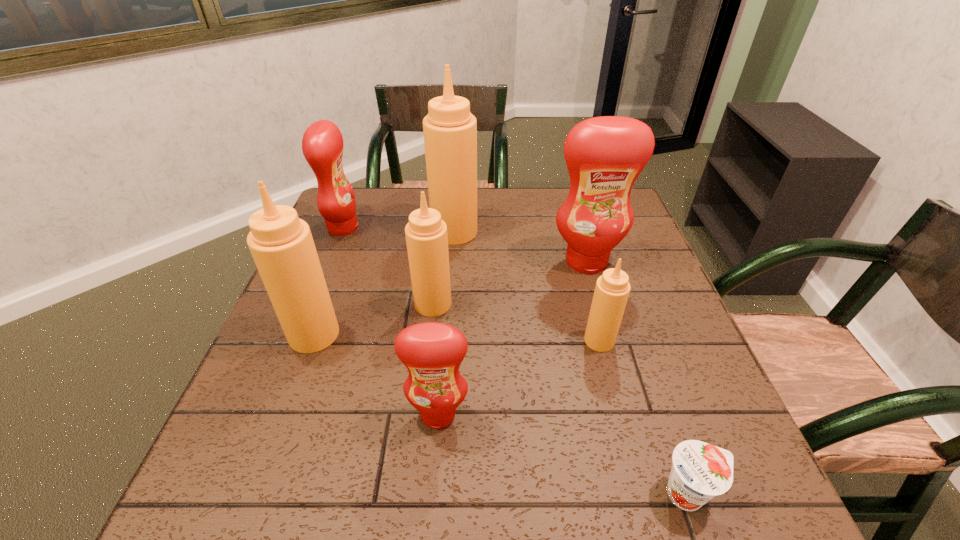
Locate an element on the screen. This screenshot has width=960, height=540. condiment that stands as the fourth closest to the second smallest red condiment is located at coordinates (604, 155).

The image size is (960, 540). In order to click on condiment object that ranks as the second closest to the third smallest tan condiment in this screenshot , I will do `click(432, 352)`.

Where is `tan condiment object that ranks as the third closest to the second smallest tan condiment`? The image size is (960, 540). tan condiment object that ranks as the third closest to the second smallest tan condiment is located at coordinates (612, 289).

Where is `the third closest tan condiment relative to the second biggest tan condiment`? This screenshot has width=960, height=540. the third closest tan condiment relative to the second biggest tan condiment is located at coordinates point(612,289).

Identify which red condiment is the second nearest to the leftmost tan condiment. Please provide its 2D coordinates. Your answer should be formatted as a tuple, i.e. [(x, y)], where the tuple contains the x and y coordinates of a point satisfying the conditions above.

[(322, 144)]

Identify which red condiment is located as the third nearest to the second smallest tan condiment. Please provide its 2D coordinates. Your answer should be formatted as a tuple, i.e. [(x, y)], where the tuple contains the x and y coordinates of a point satisfying the conditions above.

[(322, 144)]

The image size is (960, 540). Find the location of `free point that satisfies the following two spatial constraints: 1. on the label side of the farthest red condiment; 2. on the right side of the third biggest tan condiment`. free point that satisfies the following two spatial constraints: 1. on the label side of the farthest red condiment; 2. on the right side of the third biggest tan condiment is located at coordinates (312, 304).

Identify the location of blank area in the image that satisfies the following two spatial constraints: 1. on the label side of the farthest red condiment; 2. on the back side of the third smallest tan condiment. The width and height of the screenshot is (960, 540). [x=300, y=334].

Find the location of a particular element. blank space that satisfies the following two spatial constraints: 1. on the label side of the smallest tan condiment; 2. on the left side of the farthest red condiment is located at coordinates tap(297, 340).